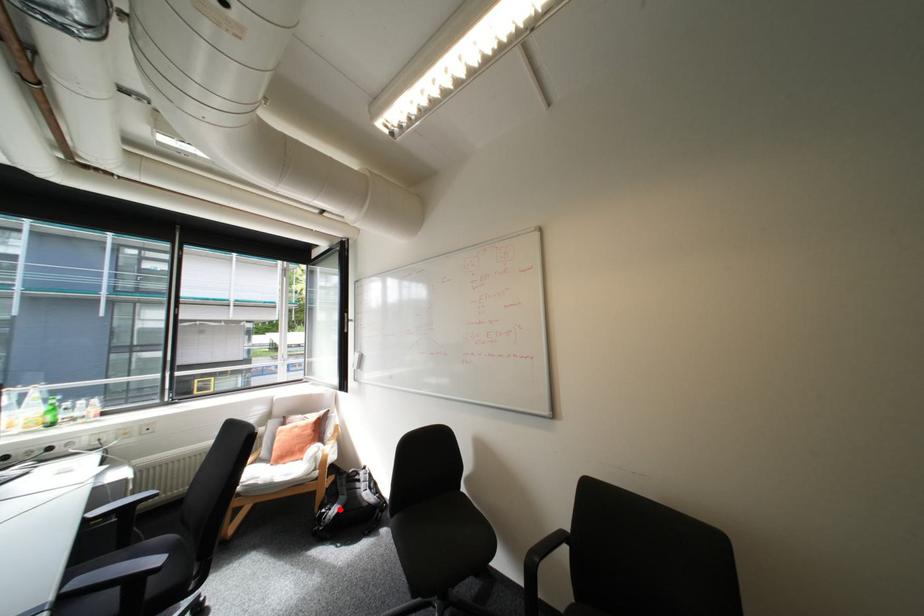
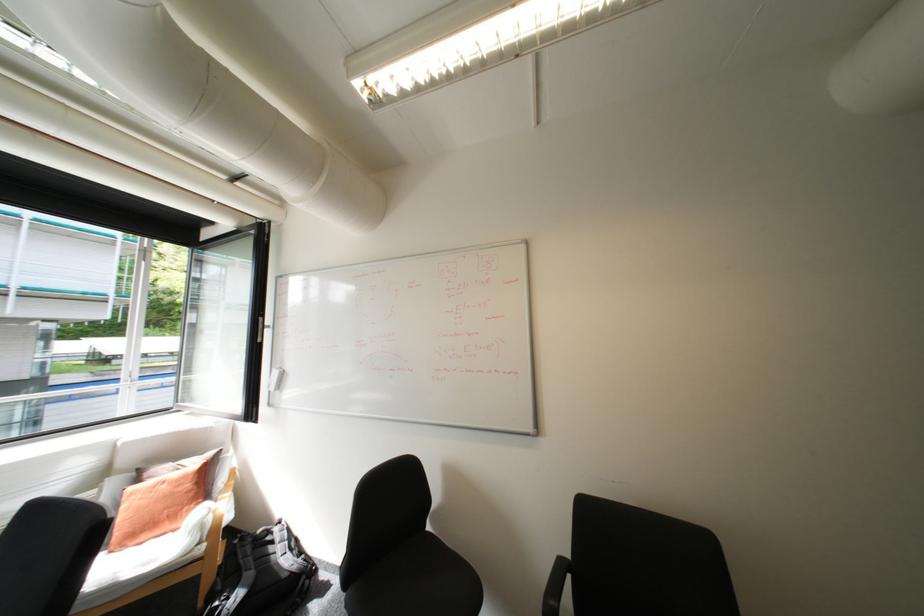
In the second image, find the point that corresponds to the highlighted location in the first image.

(238, 599)